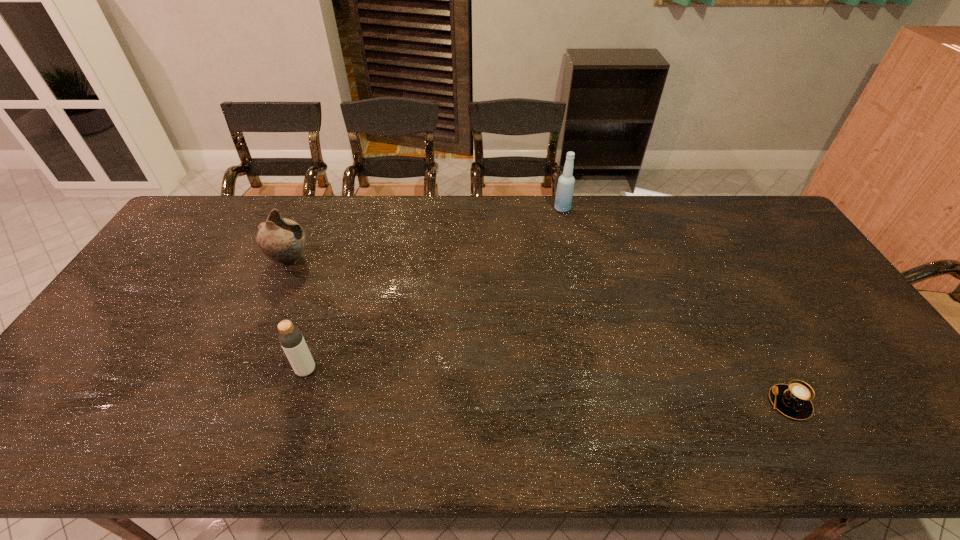
Locate an element on the screen. The image size is (960, 540). blank region between the second object from left to right and the taller bottle is located at coordinates (434, 289).

Where is `free space that is in between the nearer bottle and the leftmost object`? The image size is (960, 540). free space that is in between the nearer bottle and the leftmost object is located at coordinates (298, 315).

At what (x,y) coordinates should I click in order to perform the action: click on vacant space in between the pottery and the left bottle. Please return your answer as a coordinate pair (x, y). The image size is (960, 540). Looking at the image, I should click on (298, 315).

Locate an element on the screen. Image resolution: width=960 pixels, height=540 pixels. vacant point located between the right bottle and the pottery is located at coordinates (426, 234).

Where is `vacant area between the third object from right to left and the pottery`? The width and height of the screenshot is (960, 540). vacant area between the third object from right to left and the pottery is located at coordinates (298, 315).

At what (x,y) coordinates should I click in order to perform the action: click on unoccupied position between the shortest object and the leftmost object. Please return your answer as a coordinate pair (x, y). This screenshot has height=540, width=960. Looking at the image, I should click on pyautogui.click(x=540, y=331).

This screenshot has height=540, width=960. I want to click on vacant region between the shortest object and the pottery, so click(x=540, y=331).

This screenshot has height=540, width=960. In order to click on vacant space in between the pottery and the rightmost object in this screenshot , I will do `click(540, 331)`.

Image resolution: width=960 pixels, height=540 pixels. Find the location of `the second closest object to the pottery`. the second closest object to the pottery is located at coordinates (565, 187).

I want to click on object that is the nearest to the taller bottle, so [793, 400].